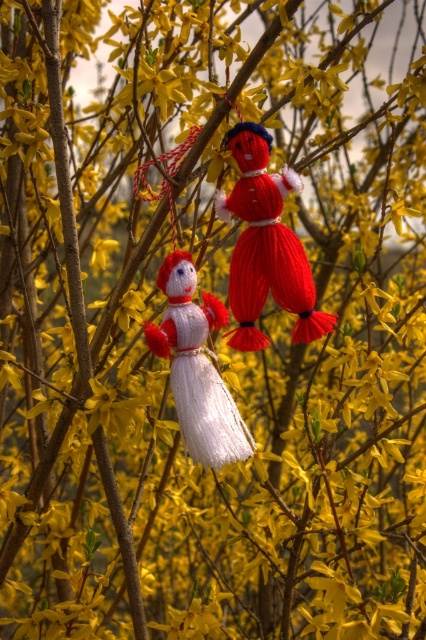
Where is the knitted red doll at center located in the image?

The knitted red doll at center is located at point (265, 244).

You are an art curator planning to photograph the knitted red doll at center and the knitted white doll at center. Since you want to focus on the red doll, which one should you adjust your camera to prioritize in the foreground?

The knitted red doll at center is further to the viewer than the knitted white doll at center, so you should prioritize focusing on the knitted red doll at center as it is already in the foreground.